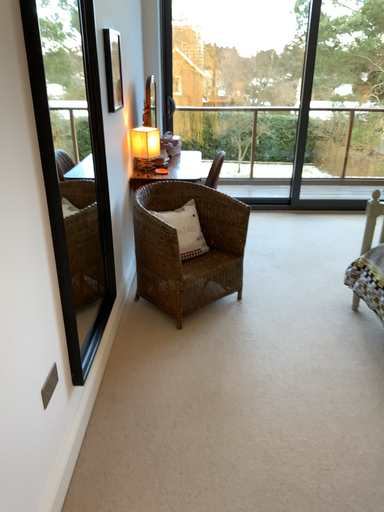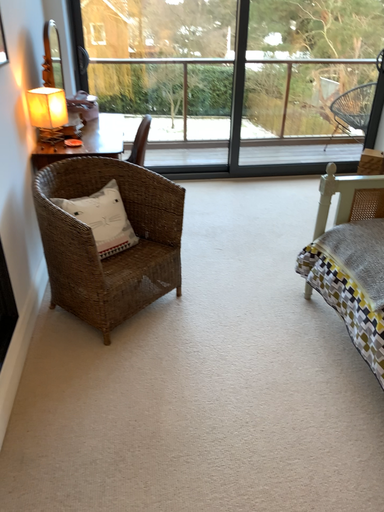
Question: How did the camera likely rotate when shooting the video?

Choices:
 (A) rotated left
 (B) rotated right

Answer: (B)